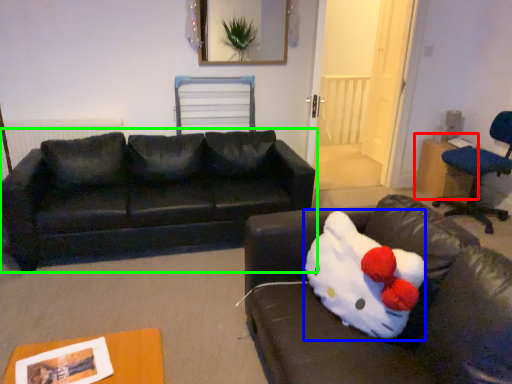
Question: Estimate the real-world distances between objects in this image. Which object is closer to table (highlighted by a red box), animal (highlighted by a blue box) or studio couch (highlighted by a green box)?

Choices:
 (A) animal
 (B) studio couch

Answer: (B)